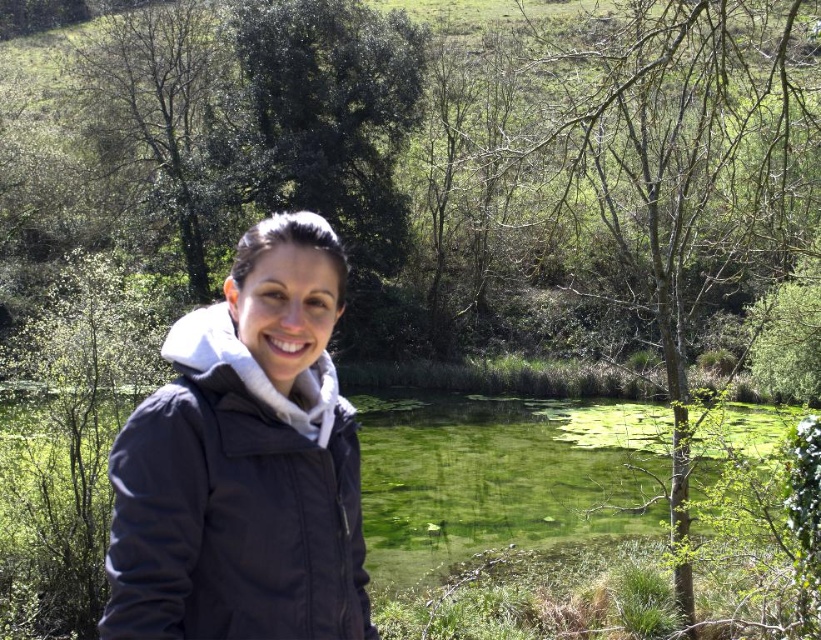
Question: Can you confirm if green leafy tree at upper center is positioned below green leafy tree at upper left?

Choices:
 (A) yes
 (B) no

Answer: (A)

Question: Which is nearer to the green leafy tree at upper center?

Choices:
 (A) navy blue jacket at center
 (B) green leafy tree at upper left

Answer: (B)

Question: Among these points, which one is farthest from the camera?

Choices:
 (A) click(328, 509)
 (B) click(667, 371)

Answer: (B)

Question: Which point is farther from the camera taking this photo?

Choices:
 (A) (214, 250)
 (B) (704, 81)
 (C) (305, 500)

Answer: (A)

Question: Is green leafy tree at upper center smaller than navy blue jacket at center?

Choices:
 (A) yes
 (B) no

Answer: (B)

Question: Does green leafy tree at upper center have a lesser width compared to navy blue jacket at center?

Choices:
 (A) no
 (B) yes

Answer: (A)